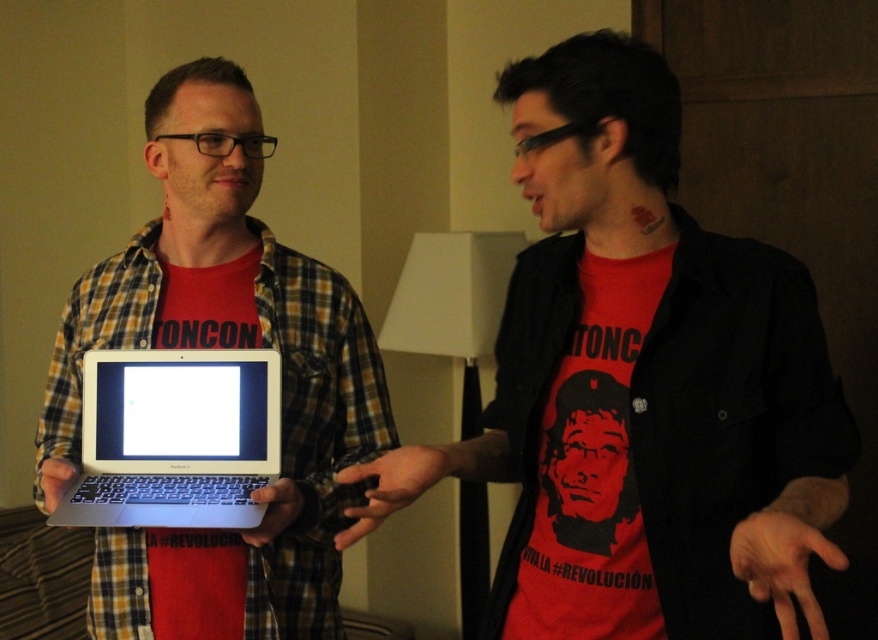
Is silver metallic laptop at left further to the viewer compared to silver metallic laptop at center?

Yes, it is behind silver metallic laptop at center.

Does silver metallic laptop at left appear over silver metallic laptop at center?

Yes.

At what (x,y) coordinates should I click in order to perform the action: click on silver metallic laptop at left. Please return your answer as a coordinate pair (x, y). This screenshot has height=640, width=878. Looking at the image, I should click on (216, 348).

At what (x,y) coordinates should I click in order to perform the action: click on silver metallic laptop at left. Please return your answer as a coordinate pair (x, y). Image resolution: width=878 pixels, height=640 pixels. Looking at the image, I should click on (216, 348).

Which is above, matte black shirt at center or silver metallic laptop at left?

matte black shirt at center is higher up.

Which is more to the left, matte black shirt at center or silver metallic laptop at left?

silver metallic laptop at left is more to the left.

Is point (732, 412) positioned after point (282, 492)?

No, (732, 412) is closer to viewer.

What are the coordinates of `matte black shirt at center` in the screenshot? It's located at (645, 392).

Is matte black shirt at center in front of silver metallic laptop at center?

Yes, it is in front of silver metallic laptop at center.

How distant is matte black shirt at center from silver metallic laptop at center?

matte black shirt at center is 14.90 inches from silver metallic laptop at center.

Which is in front, point (430, 470) or point (254, 432)?

Point (430, 470) is in front.

Image resolution: width=878 pixels, height=640 pixels. In order to click on matte black shirt at center in this screenshot , I will do `click(645, 392)`.